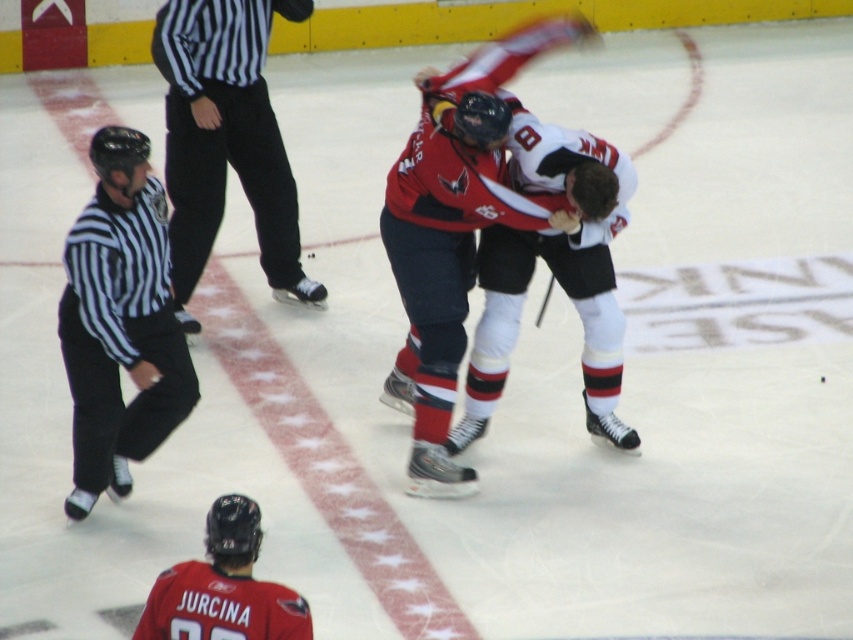
Question: Which point appears farthest from the camera in this image?

Choices:
 (A) (262, 588)
 (B) (606, 413)

Answer: (B)

Question: Can you confirm if striped jersey referee at left is positioned above red jersey hockey player at lower left?

Choices:
 (A) no
 (B) yes

Answer: (B)

Question: Which point is closer to the camera?

Choices:
 (A) (585, 188)
 (B) (254, 150)
 (C) (73, 284)

Answer: (C)

Question: Estimate the real-world distances between objects in this image. Which object is closer to the striped jersey referee at left?

Choices:
 (A) red jersey at center
 (B) black striped shirt at upper left
 (C) red jersey hockey player at lower left

Answer: (A)

Question: Does striped jersey referee at left appear over red jersey at center?

Choices:
 (A) yes
 (B) no

Answer: (B)

Question: Does striped jersey referee at left have a larger size compared to red jersey at center?

Choices:
 (A) no
 (B) yes

Answer: (A)